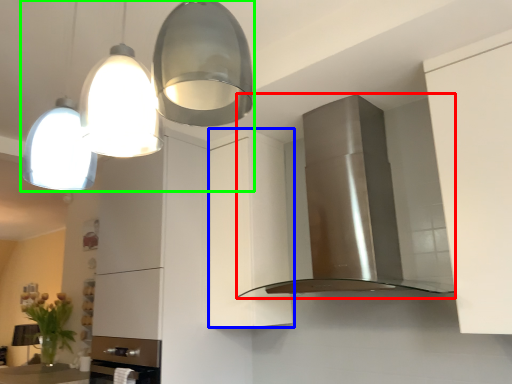
Question: Estimate the real-world distances between objects in this image. Which object is closer to home appliance (highlighted by a red box), cabinetry (highlighted by a blue box) or light fixture (highlighted by a green box)?

Choices:
 (A) cabinetry
 (B) light fixture

Answer: (A)